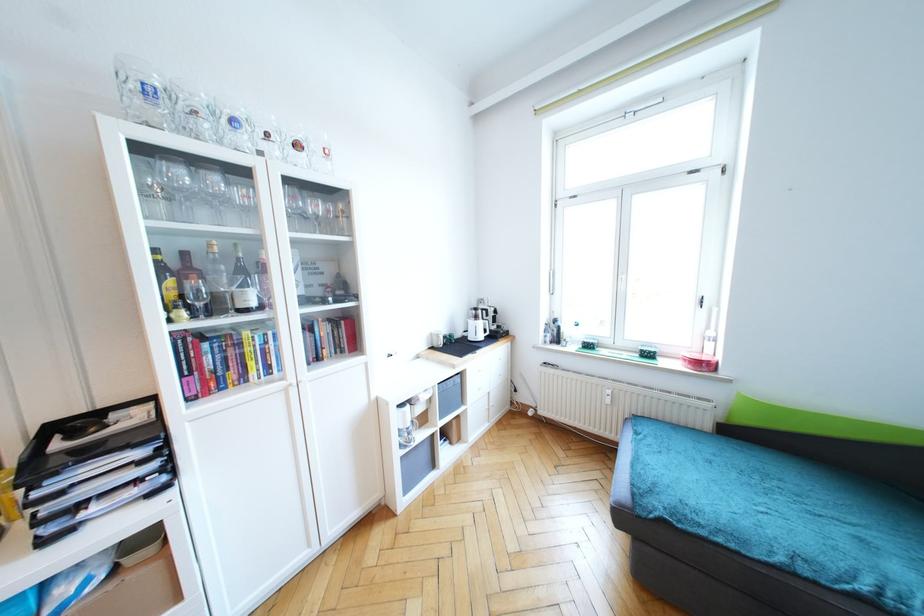
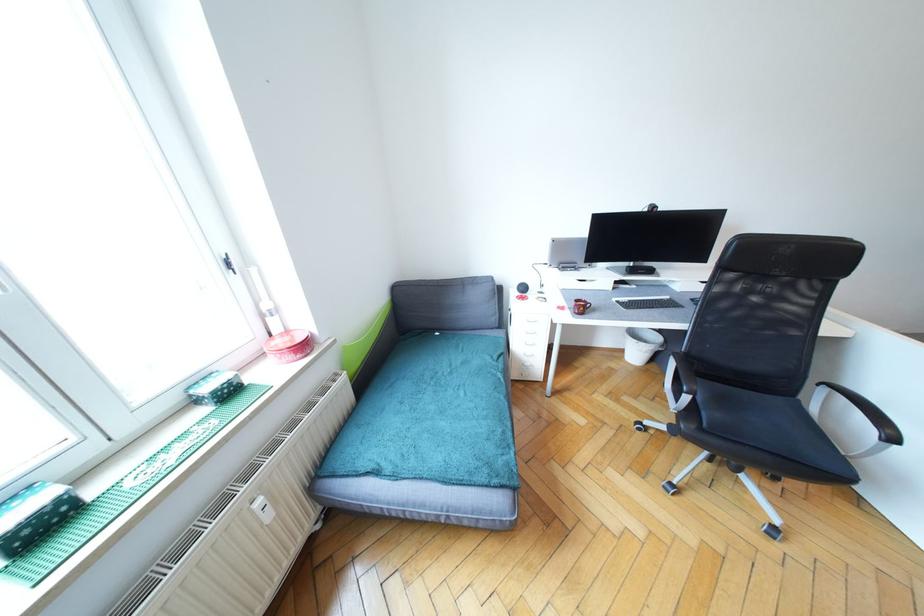
Find the pixel in the second image that matches (x=713, y=334) in the first image.

(270, 307)